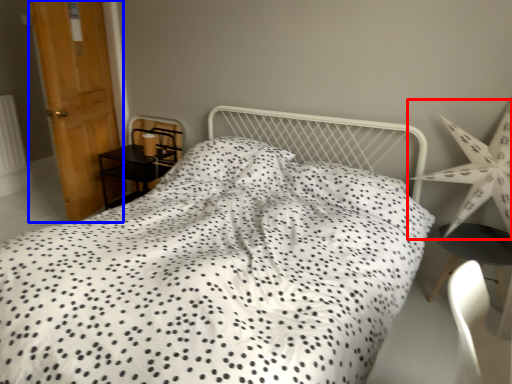
Question: Which object appears closest to the camera in this image, star (highlighted by a red box) or door (highlighted by a blue box)?

Choices:
 (A) star
 (B) door

Answer: (A)